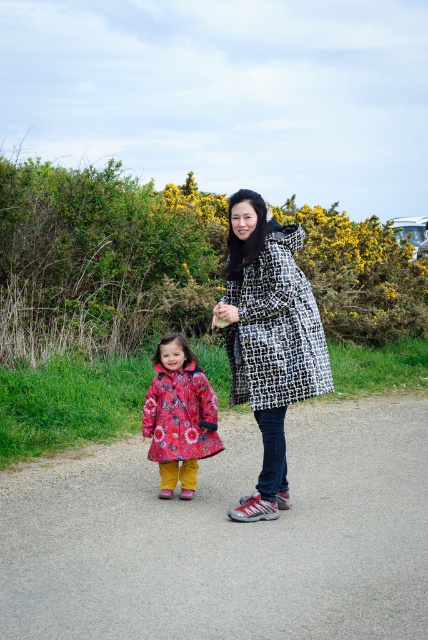
Measure the distance between gray asphalt path at center and black and white checkered coat at center.

gray asphalt path at center is 5.27 feet away from black and white checkered coat at center.

Is point (145, 609) positioned behind point (246, 276)?

No.

Who is more forward, (x=116, y=632) or (x=285, y=252)?

Point (x=116, y=632) is in front.

The image size is (428, 640). I want to click on gray asphalt path at center, so click(x=226, y=536).

Does gray asphalt path at center have a lesser width compared to floral-patterned coat at center?

Incorrect, gray asphalt path at center's width is not less than floral-patterned coat at center's.

Is point (95, 573) farther from viewer compared to point (202, 451)?

No, it is not.

Where is `gray asphalt path at center`? This screenshot has height=640, width=428. gray asphalt path at center is located at coordinates (226, 536).

Does black and white checkered coat at center have a lesser width compared to floral-patterned coat at center?

No, black and white checkered coat at center is not thinner than floral-patterned coat at center.

Does black and white checkered coat at center come in front of floral-patterned coat at center?

Yes, it is.

Find the location of a particular element. The height and width of the screenshot is (640, 428). black and white checkered coat at center is located at coordinates (276, 326).